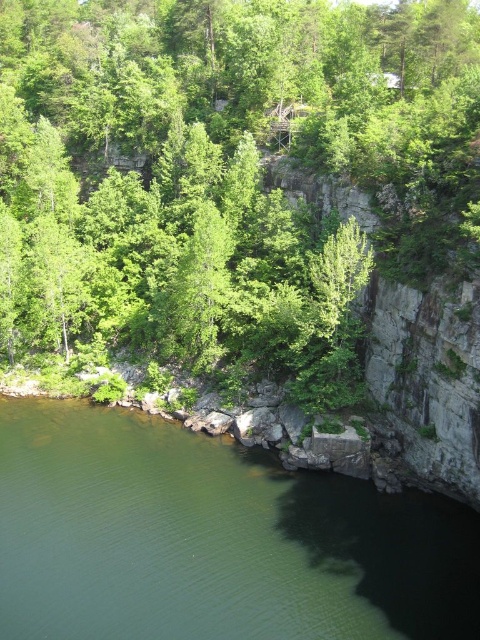
You are standing at the point marked as point (228,176) in the image. Looking around, you see a steep cliff face on the right and a lush green area on the left. Which direction should you walk to reach the green leafy tree at upper center?

You should walk towards the upper center direction to reach the green leafy tree at upper center since the point (228,176) is located on it.

Based on the photo, you are a hiker standing at the base of the cliff on the right side of the image. You notice a green leafy tree at upper center and a green smooth water at lower left. Which object is bigger in size?

The green leafy tree at upper center is larger in size than the green smooth water at lower left.

You are a hiker standing at the base of the cliff on the right side of the image. You want to reach the green smooth water at lower left without crossing the green leafy tree at upper center. Is it possible to do so while staying within the visible area of the image?

The green leafy tree at upper center and green smooth water at lower left are 32.30 meters apart, so yes, you can reach the green smooth water at lower left without crossing the tree as they are separated by a distance of 32.30 meters.